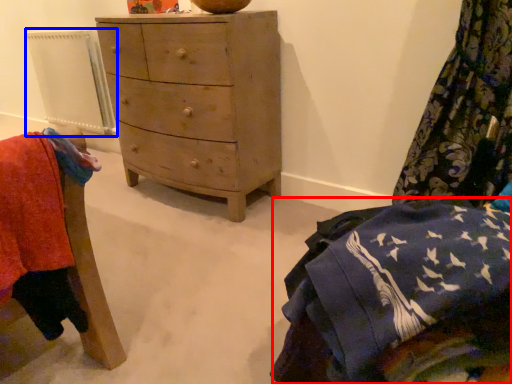
Question: Which object appears closest to the camera in this image, clothing (highlighted by a red box) or radiator (highlighted by a blue box)?

Choices:
 (A) clothing
 (B) radiator

Answer: (A)